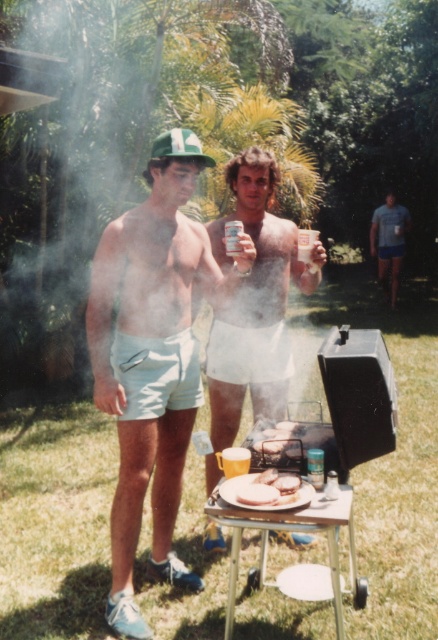
Does point (152, 388) lie in front of point (289, 476)?

No, (152, 388) is further to viewer.

Can you confirm if light blue cotton shorts at left is bigger than white matte sandwich at center?

Yes, light blue cotton shorts at left is bigger than white matte sandwich at center.

Does point (176, 422) lie behind point (261, 476)?

Yes, point (176, 422) is farther from viewer.

Image resolution: width=438 pixels, height=640 pixels. What are the coordinates of `light blue cotton shorts at left` in the screenshot? It's located at (152, 358).

Does light blue cotton shorts at left appear under white matte shorts at center?

Correct, light blue cotton shorts at left is located below white matte shorts at center.

This screenshot has width=438, height=640. What are the coordinates of `light blue cotton shorts at left` in the screenshot? It's located at (152, 358).

Where is `light blue cotton shorts at left`? light blue cotton shorts at left is located at coordinates (152, 358).

Does white matte shorts at center appear over blue cotton shirt at right?

No, white matte shorts at center is not above blue cotton shirt at right.

Does white matte shorts at center appear on the left side of blue cotton shirt at right?

Correct, you'll find white matte shorts at center to the left of blue cotton shirt at right.

Is point (282, 532) positioned before point (381, 241)?

Yes, point (282, 532) is closer to viewer.

The height and width of the screenshot is (640, 438). Find the location of `white matte shorts at center`. white matte shorts at center is located at coordinates (254, 301).